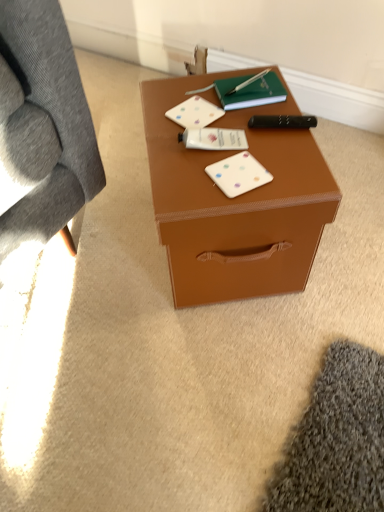
This screenshot has width=384, height=512. I want to click on vacant area situated to the left side of black plastic remote control at right, so click(207, 128).